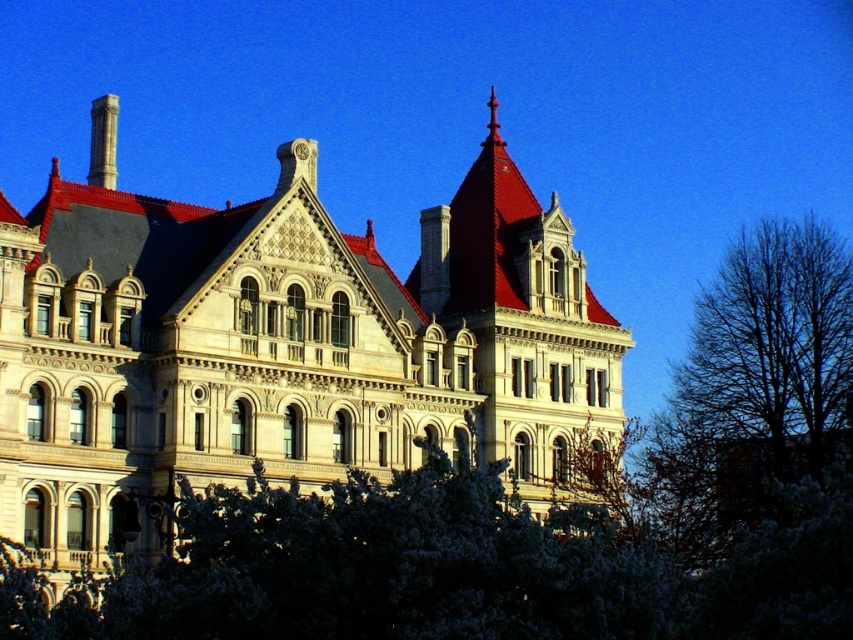
Question: Can you confirm if stone building at center is bigger than bare branches at right?

Choices:
 (A) yes
 (B) no

Answer: (A)

Question: Can you confirm if stone building at center is positioned to the right of white textured leaves at center?

Choices:
 (A) no
 (B) yes

Answer: (A)

Question: From the image, what is the correct spatial relationship of stone building at center in relation to bare branches at right?

Choices:
 (A) below
 (B) above

Answer: (B)

Question: Based on their relative distances, which object is farther from the white textured leaves at center?

Choices:
 (A) bare branches at right
 (B) stone building at center

Answer: (A)

Question: Considering the real-world distances, which object is farthest from the bare branches at right?

Choices:
 (A) white textured leaves at center
 (B) stone building at center

Answer: (A)

Question: Based on their relative distances, which object is farther from the stone building at center?

Choices:
 (A) white textured leaves at center
 (B) bare branches at right

Answer: (B)